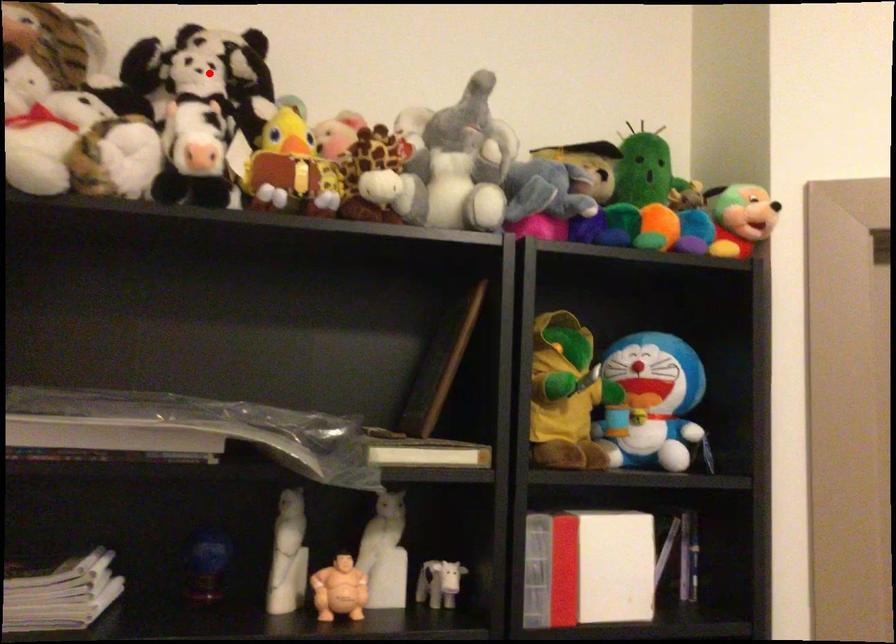
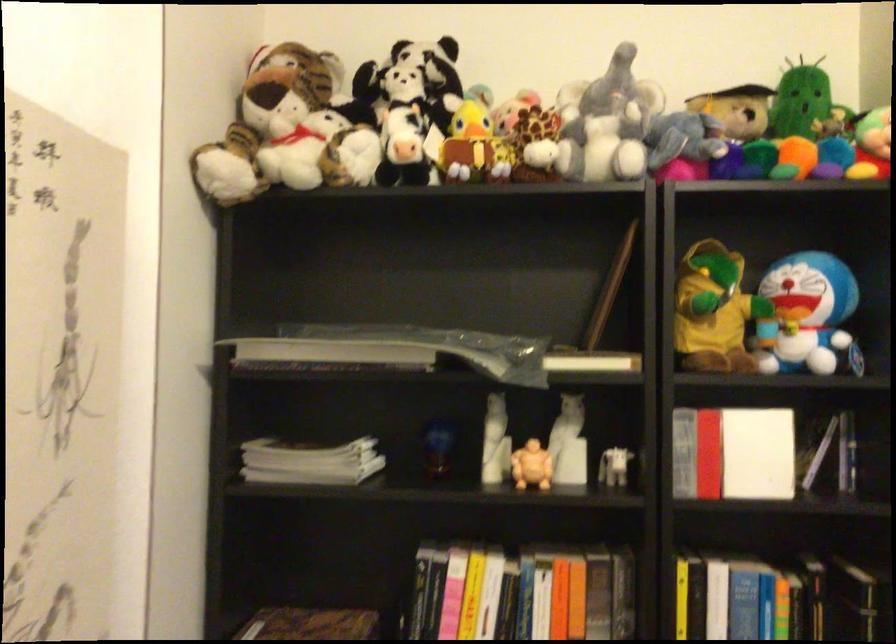
The point at the highlighted location is marked in the first image. Where is the corresponding point in the second image?

(410, 79)